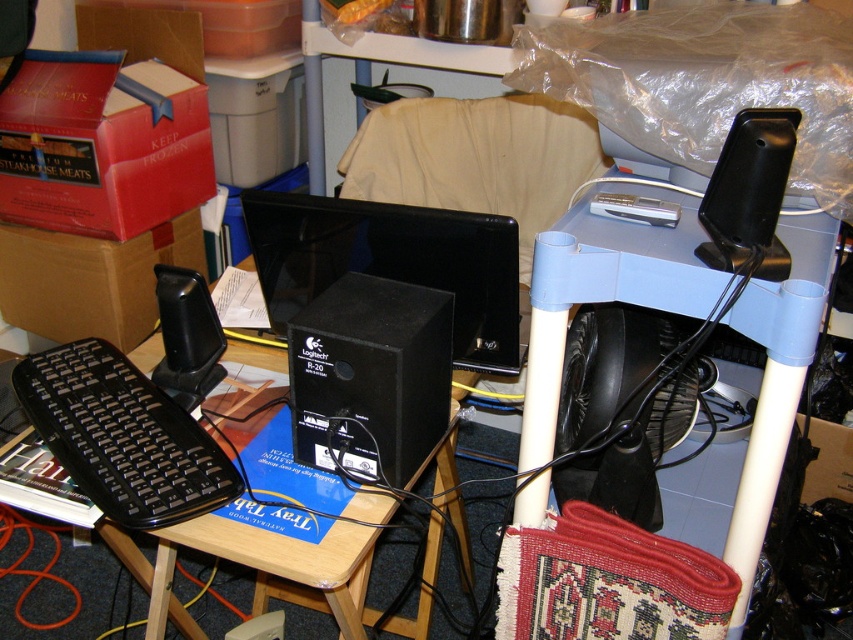
Question: Estimate the real-world distances between objects in this image. Which object is farther from the black plastic keyboard at lower left?

Choices:
 (A) blue plastic table at center
 (B) black plastic speaker at upper right

Answer: (B)

Question: Is red cardboard box at upper left smaller than black plastic keyboard at lower left?

Choices:
 (A) yes
 (B) no

Answer: (B)

Question: Is black wood table at center to the right of black plastic speaker at left from the viewer's perspective?

Choices:
 (A) no
 (B) yes

Answer: (B)

Question: Estimate the real-world distances between objects in this image. Which object is closer to the red cardboard box at upper left?

Choices:
 (A) black plastic keyboard at lower left
 (B) blue plastic table at center

Answer: (A)

Question: Can you confirm if matte cardboard box at left is smaller than black plastic speaker at left?

Choices:
 (A) no
 (B) yes

Answer: (A)

Question: Estimate the real-world distances between objects in this image. Which object is farther from the black plastic speaker at left?

Choices:
 (A) blue plastic table at center
 (B) black matte speaker at center
 (C) black plastic keyboard at lower left
 (D) matte cardboard box at left

Answer: (D)